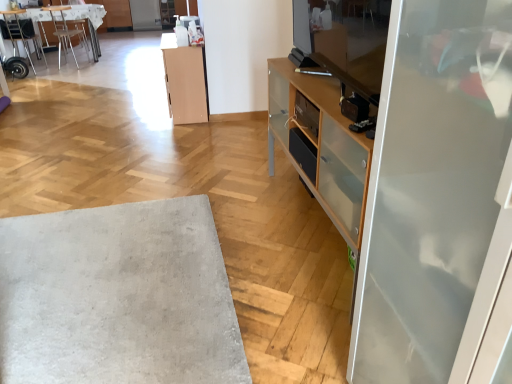
Find the location of a particular element. This screenshot has width=512, height=384. free point below white soft rug at lower left (from a real-world perspective) is located at coordinates (105, 282).